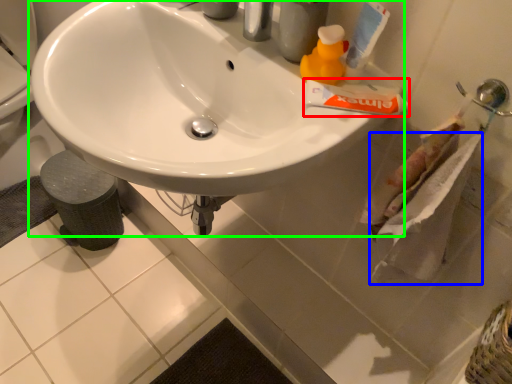
Question: Which is farther away from toothpaste (highlighted by a red box)? toilet paper (highlighted by a blue box) or sink (highlighted by a green box)?

Choices:
 (A) toilet paper
 (B) sink

Answer: (B)